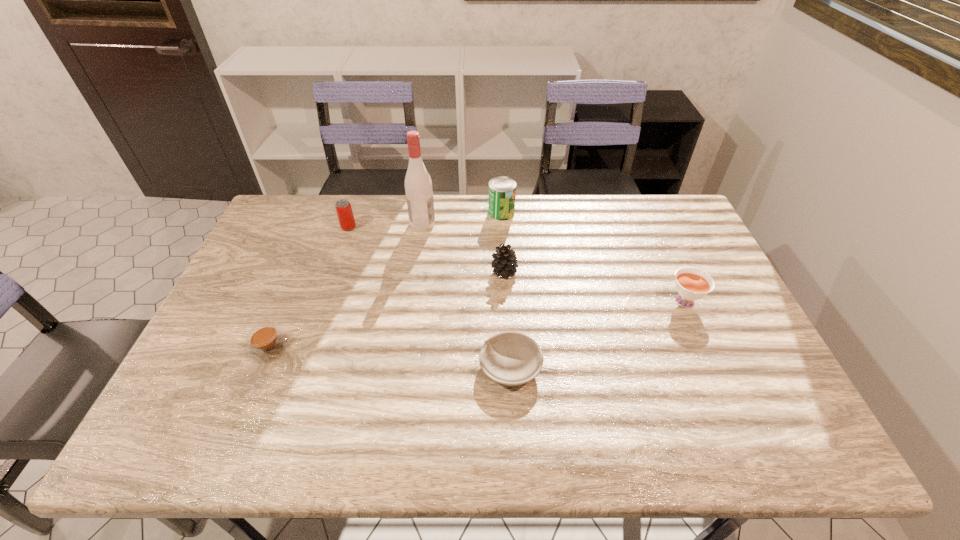
The width and height of the screenshot is (960, 540). In order to click on free space that satisfies the following two spatial constraints: 1. on the back side of the sixth object from right to left; 2. on the right side of the cappuccino in this screenshot , I will do 319,227.